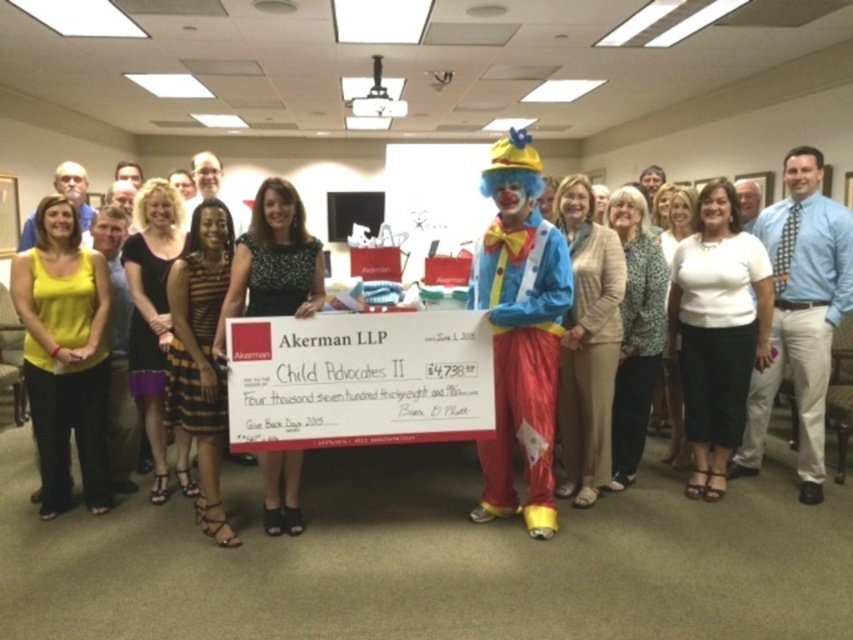
You are a photographer taking a photo of the ceremonial check. You notice two people in the front row wearing the yellow fabric tank top at center and the white matte blouse at center. Which clothing item is more visible in the photo?

The yellow fabric tank top at center is closer to the viewer than the white matte blouse at center, so it will be more visible in the photo.

From the picture: You are an event photographer at the ceremony. You need to capture a closeup of the check while ensuring both the yellow fabric tank top at center and the blue tie at center are visible in the frame. Which object should you focus on to ensure both are in the same shot without cropping?

The yellow fabric tank top at center is shorter than the blue tie at center, so focusing on the yellow fabric tank top at center will allow the blue tie at center to remain in the frame as it is taller.